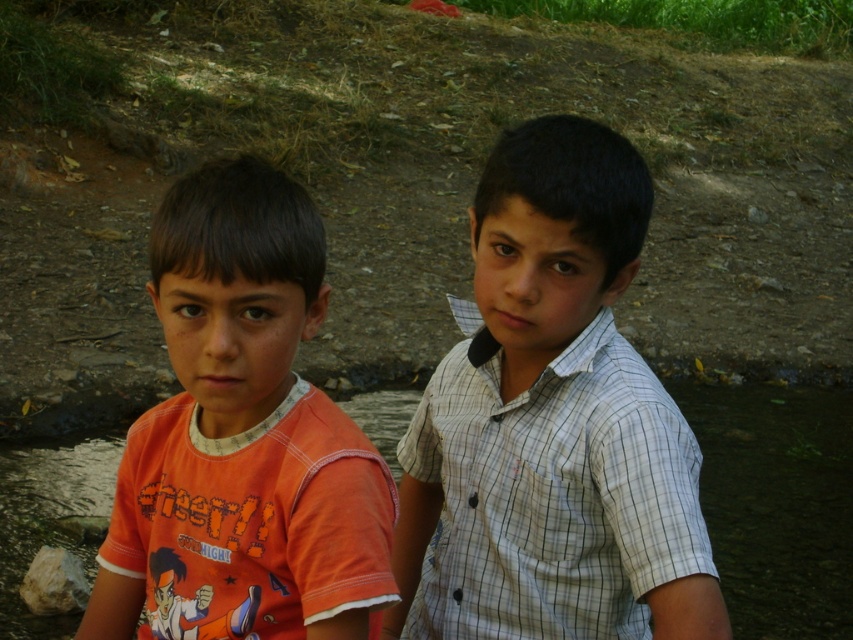
Question: Where is clear water at creek right located in relation to gray rough rock at lower left in the image?

Choices:
 (A) right
 (B) left

Answer: (A)

Question: Considering the relative positions of white checkered shirt at center and gray rough rock at lower left in the image provided, where is white checkered shirt at center located with respect to gray rough rock at lower left?

Choices:
 (A) left
 (B) right

Answer: (B)

Question: Which of the following is the closest to the observer?

Choices:
 (A) (35, 556)
 (B) (152, 236)
 (C) (524, 166)

Answer: (B)

Question: Is the position of white checkered shirt at center more distant than that of gray rough rock at lower left?

Choices:
 (A) yes
 (B) no

Answer: (B)

Question: Which point appears closest to the camera in this image?

Choices:
 (A) (762, 435)
 (B) (283, 392)
 (C) (605, 564)
 (D) (80, 561)

Answer: (B)

Question: Which point appears closest to the camera in this image?

Choices:
 (A) (579, 180)
 (B) (770, 412)

Answer: (A)